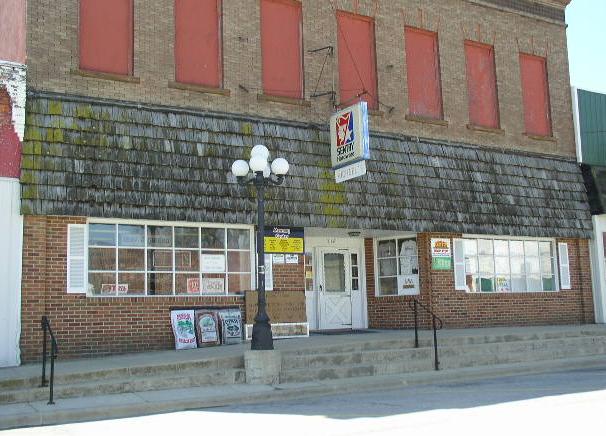
The height and width of the screenshot is (436, 606). What are the coordinates of `door` in the screenshot? It's located at (333, 301).